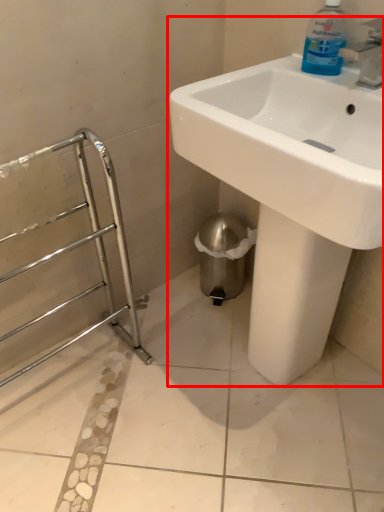
Question: From the image's perspective, where is sink (annotated by the red box) located in relation to cleaning product in the image?

Choices:
 (A) below
 (B) above

Answer: (A)